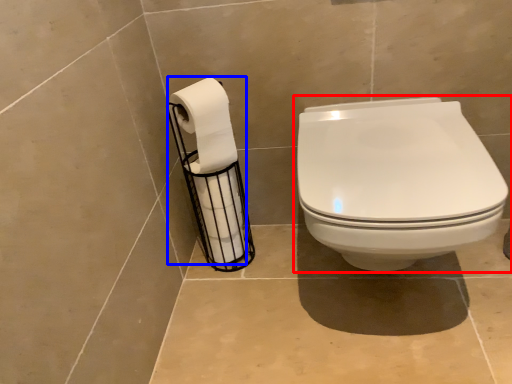
Question: Which point is further to the camera, toilet (highlighted by a red box) or toilet paper (highlighted by a blue box)?

Choices:
 (A) toilet
 (B) toilet paper

Answer: (B)